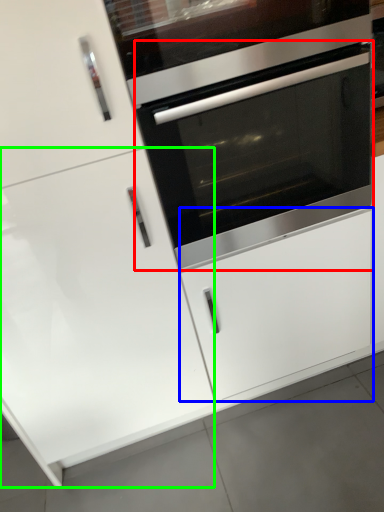
Question: Which is farther away from oven (highlighted by a red box)? drawer (highlighted by a blue box) or door (highlighted by a green box)?

Choices:
 (A) drawer
 (B) door

Answer: (B)